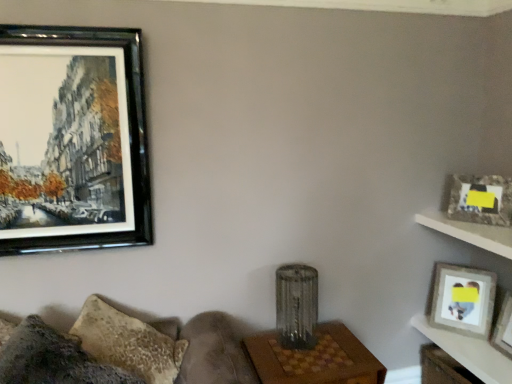
Question: Is wooden table at center, the 1th table viewed from the left, smaller than wooden table at lower right, positioned as the 2th table in left-to-right order?

Choices:
 (A) yes
 (B) no

Answer: (B)

Question: Does wooden table at center, which is the 2th table from right to left, have a lesser width compared to wooden table at lower right, which is the 1th table in right-to-left order?

Choices:
 (A) no
 (B) yes

Answer: (A)

Question: Can you confirm if wooden table at center, which is the 2th table from right to left, is taller than wooden table at lower right, positioned as the 2th table in left-to-right order?

Choices:
 (A) yes
 (B) no

Answer: (A)

Question: Does wooden table at center, the 1th table viewed from the left, turn towards wooden table at lower right, positioned as the 2th table in left-to-right order?

Choices:
 (A) yes
 (B) no

Answer: (B)

Question: From the image's perspective, is wooden table at center, the 1th table viewed from the left, on wooden table at lower right, positioned as the 2th table in left-to-right order?

Choices:
 (A) yes
 (B) no

Answer: (B)

Question: Considering the relative positions of wooden table at center, which is the 2th table from right to left, and wooden table at lower right, which is the 1th table in right-to-left order, in the image provided, is wooden table at center, which is the 2th table from right to left, behind wooden table at lower right, which is the 1th table in right-to-left order,?

Choices:
 (A) yes
 (B) no

Answer: (B)

Question: Is white wood shelf at upper right closer to camera compared to wooden table at center, which is the 2th table from right to left?

Choices:
 (A) yes
 (B) no

Answer: (B)

Question: From the image's perspective, is white wood shelf at upper right beneath wooden table at center, the 1th table viewed from the left?

Choices:
 (A) yes
 (B) no

Answer: (B)

Question: From a real-world perspective, is white wood shelf at upper right on top of wooden table at center, which is the 2th table from right to left?

Choices:
 (A) no
 (B) yes

Answer: (B)

Question: Can you confirm if white wood shelf at upper right is positioned to the right of wooden table at center, the 1th table viewed from the left?

Choices:
 (A) yes
 (B) no

Answer: (A)

Question: Considering the relative positions of white wood shelf at upper right and wooden table at center, which is the 2th table from right to left, in the image provided, is white wood shelf at upper right behind wooden table at center, which is the 2th table from right to left,?

Choices:
 (A) yes
 (B) no

Answer: (A)

Question: Considering the relative sizes of white wood shelf at upper right and wooden table at center, the 1th table viewed from the left, in the image provided, is white wood shelf at upper right taller than wooden table at center, the 1th table viewed from the left,?

Choices:
 (A) no
 (B) yes

Answer: (A)

Question: Does black glossy picture frame at upper left, which is the 3th picture frame in bottom-to-top order, have a lesser height compared to textured gray couch at lower left?

Choices:
 (A) no
 (B) yes

Answer: (A)